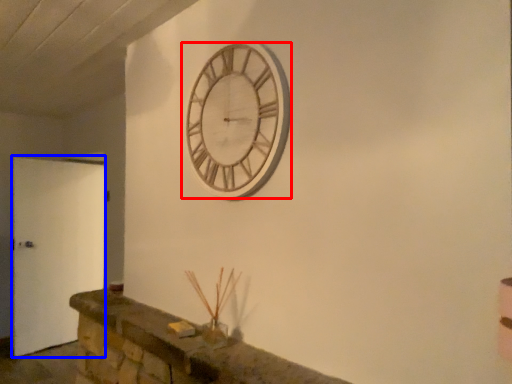
Question: Which point is closer to the camera, wall clock (highlighted by a red box) or door (highlighted by a blue box)?

Choices:
 (A) wall clock
 (B) door

Answer: (A)